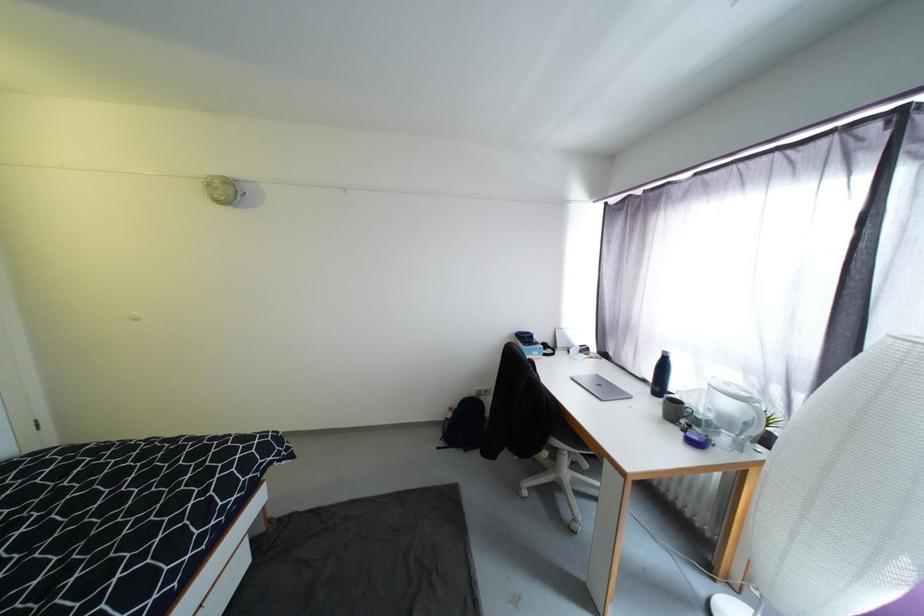
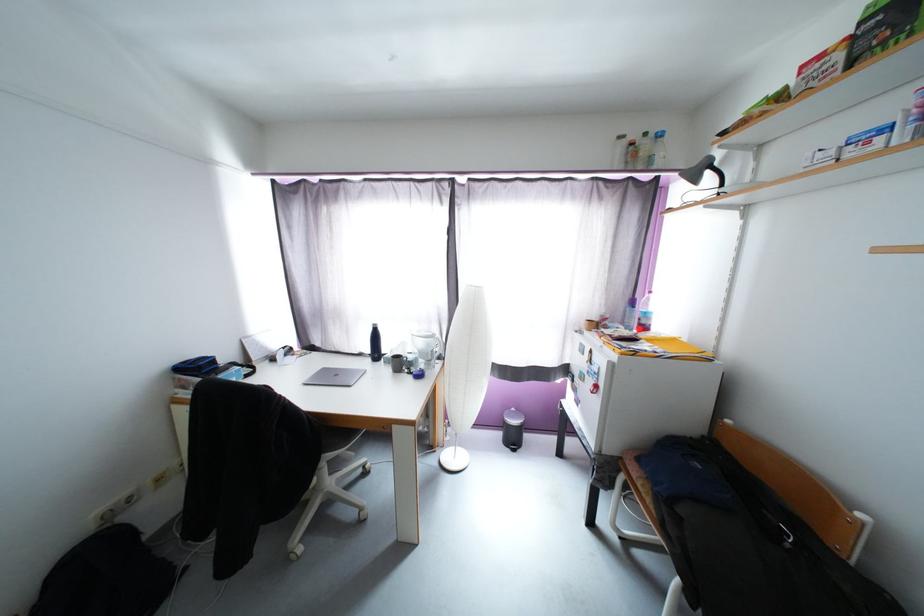
The point at (580, 521) is marked in the first image. Where is the corresponding point in the second image?

(367, 511)